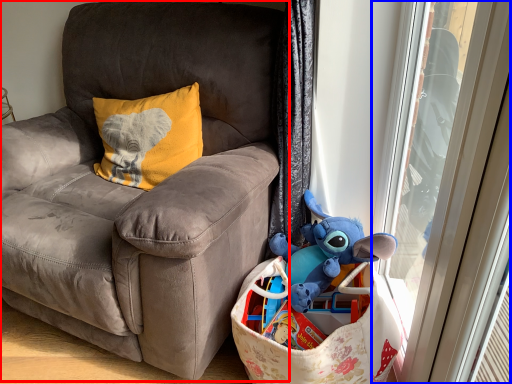
Question: Among these objects, which one is nearest to the camera, chair (highlighted by a red box) or screen door (highlighted by a blue box)?

Choices:
 (A) chair
 (B) screen door

Answer: (A)